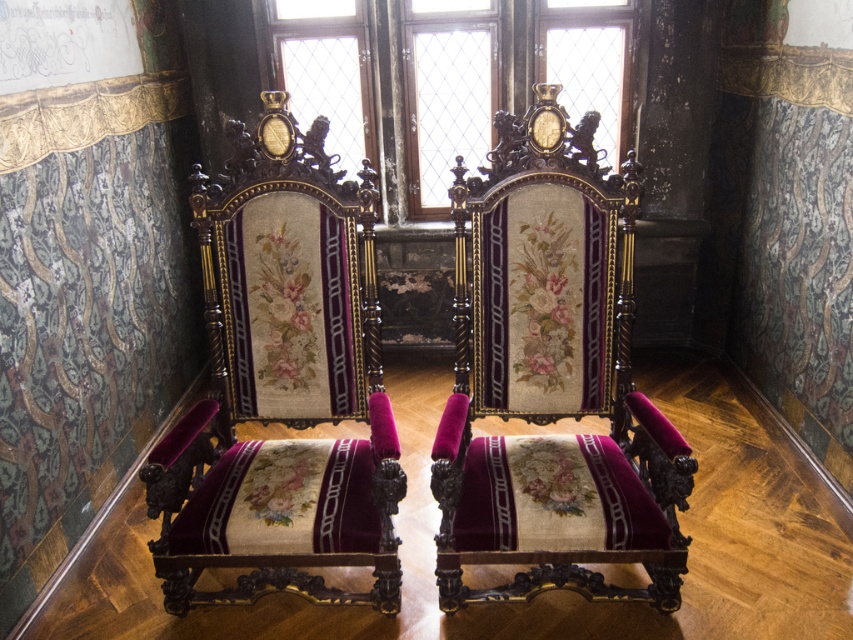
Who is positioned more to the right, velvetmatte black armchair at center or matte wood window at center?

Positioned to the right is velvetmatte black armchair at center.

In the scene shown: Does velvetmatte black armchair at center come behind matte wood window at center?

No, it is in front of matte wood window at center.

Between point (532, 592) and point (299, 68), which one is positioned in front?

Point (532, 592) is more forward.

Image resolution: width=853 pixels, height=640 pixels. Identify the location of velvetmatte black armchair at center. (552, 369).

Image resolution: width=853 pixels, height=640 pixels. Describe the element at coordinates (323, 68) in the screenshot. I see `matte wood window at center` at that location.

Between matte wood window at center and clear glass window at upper center, which one appears on the right side from the viewer's perspective?

Positioned to the right is clear glass window at upper center.

Based on the photo, measure the distance between matte wood window at center and camera.

10.61 feet

Locate an element on the screen. matte wood window at center is located at coordinates (323, 68).

Between velvetvelvetarmchair at left and clear glass window at center, which one appears on the right side from the viewer's perspective?

Positioned to the right is clear glass window at center.

Is velvetvelvetarmchair at left shorter than clear glass window at center?

In fact, velvetvelvetarmchair at left may be taller than clear glass window at center.

You are a GUI agent. You are given a task and a screenshot of the screen. Output one action in this format:
    pyautogui.click(x=<x>, y=<y>)
    Task: Click on the velvetvelvetarmchair at left
    The width and height of the screenshot is (853, 640).
    Given the screenshot: What is the action you would take?
    pyautogui.click(x=282, y=378)